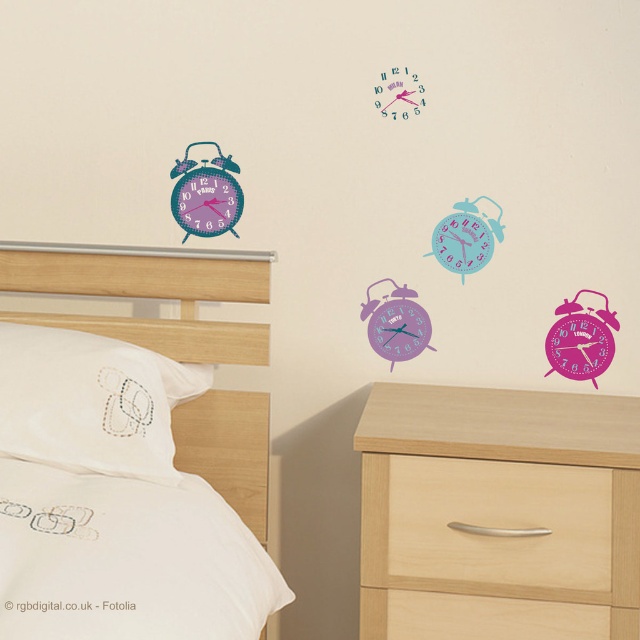
Describe the element at coordinates (580, 339) in the screenshot. I see `pink glossy alarm clock at upper right` at that location.

Can you confirm if pink glossy alarm clock at upper right is smaller than purple glossy alarm clock at center?

No, pink glossy alarm clock at upper right is not smaller than purple glossy alarm clock at center.

What do you see at coordinates (580, 339) in the screenshot?
I see `pink glossy alarm clock at upper right` at bounding box center [580, 339].

Locate an element on the screen. The width and height of the screenshot is (640, 640). pink glossy alarm clock at upper right is located at coordinates (580, 339).

Is light wood/texture drawer at lower center below purple glossy alarm clock at center?

Indeed, light wood/texture drawer at lower center is positioned under purple glossy alarm clock at center.

Which of these two, light wood/texture drawer at lower center or purple glossy alarm clock at center, stands shorter?

purple glossy alarm clock at center

Which is behind, point (496, 580) or point (410, 298)?

The point (410, 298) is behind.

I want to click on light wood/texture drawer at lower center, so click(499, 522).

Is white fabric bed at upper left to the right of light wood/dark finish drawer at lower center from the viewer's perspective?

No, white fabric bed at upper left is not to the right of light wood/dark finish drawer at lower center.

Is white fabric bed at upper left smaller than light wood/dark finish drawer at lower center?

No, white fabric bed at upper left is not smaller than light wood/dark finish drawer at lower center.

Find the location of a particular element. white fabric bed at upper left is located at coordinates (148, 298).

Locate an element on the screen. white fabric bed at upper left is located at coordinates (148, 298).